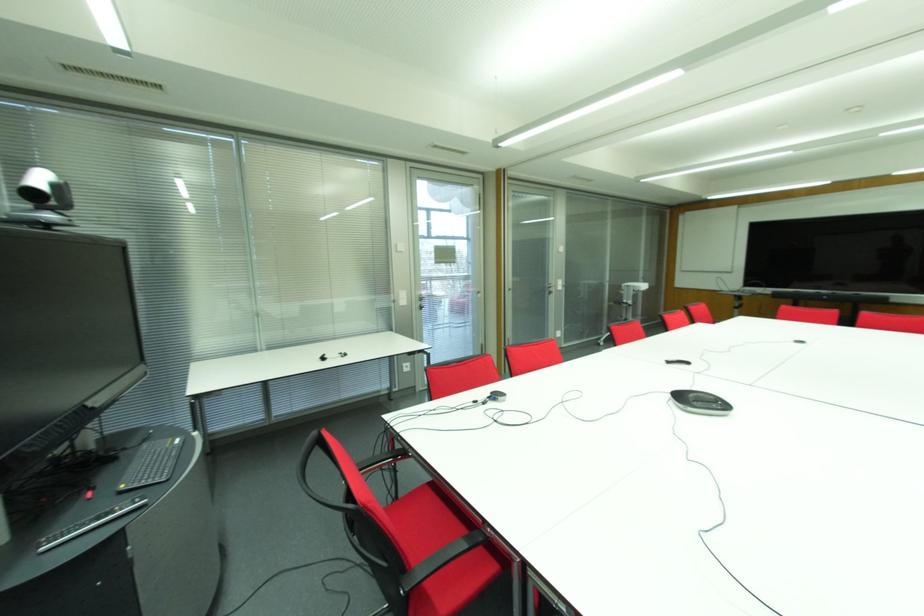
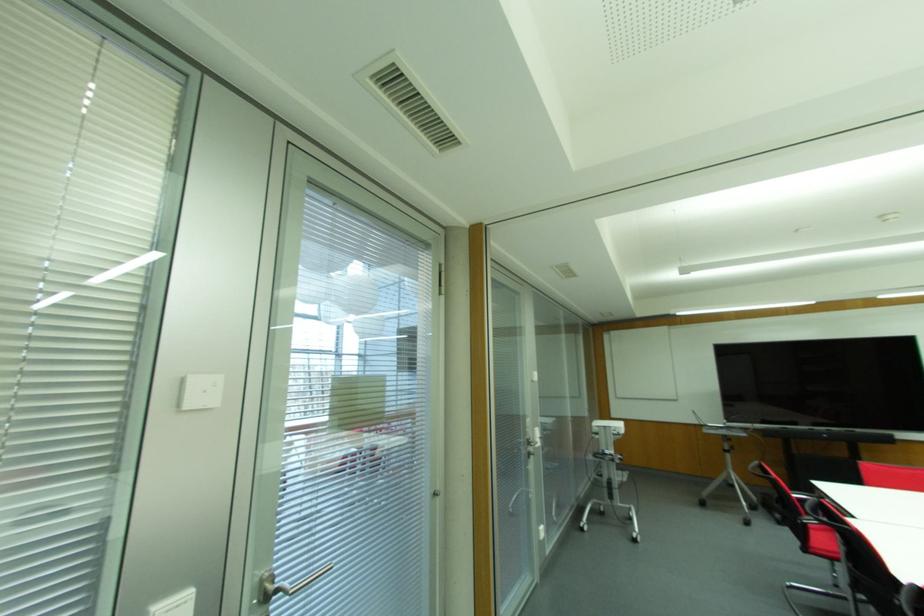
The point at [396,251] is marked in the first image. Where is the corresponding point in the second image?

(178, 406)